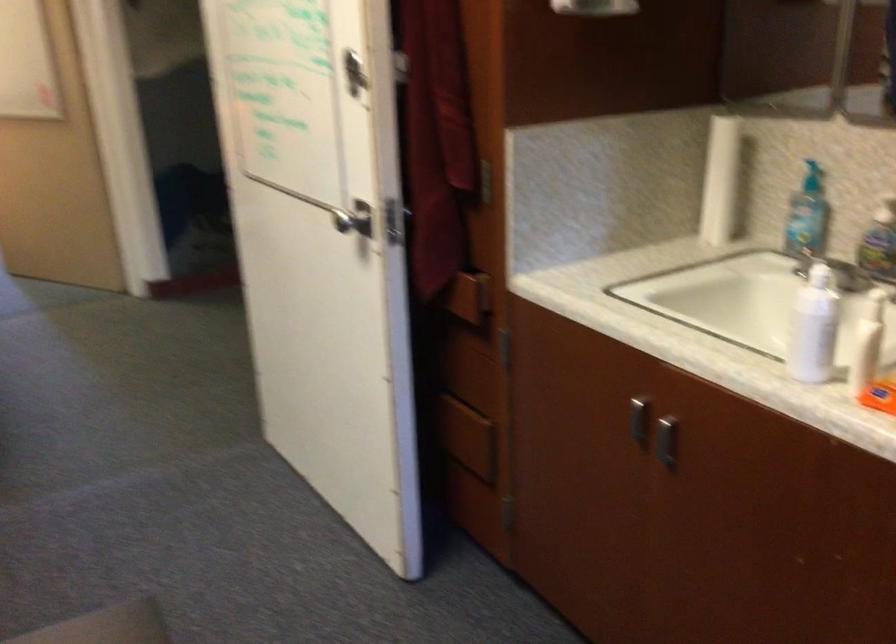
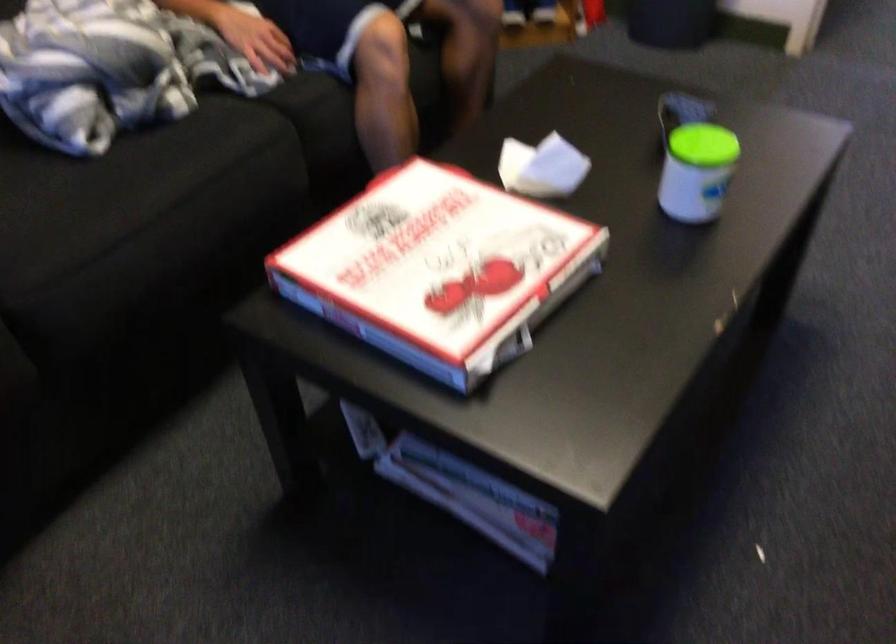
Based on the continuous images, in which direction is the camera rotating?

The camera rotated toward left-down.